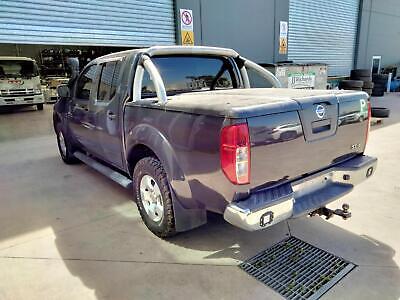
You are a GUI agent. You are given a task and a screenshot of the screen. Output one action in this format:
    pyautogui.click(x=<x>, y=<y>)
    Task: Click on the latch
    The width and height of the screenshot is (400, 300).
    Given the screenshot: What is the action you would take?
    pyautogui.click(x=320, y=126)